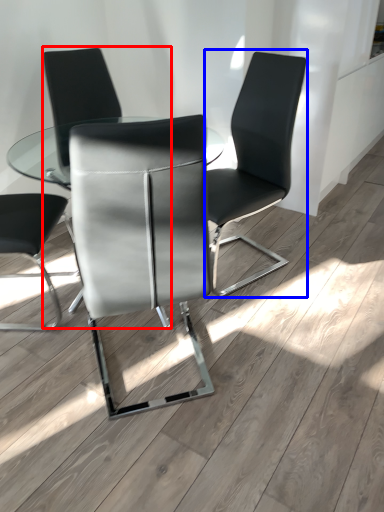
Question: Which object appears farthest to the camera in this image, chair (highlighted by a red box) or chair (highlighted by a blue box)?

Choices:
 (A) chair
 (B) chair

Answer: (A)